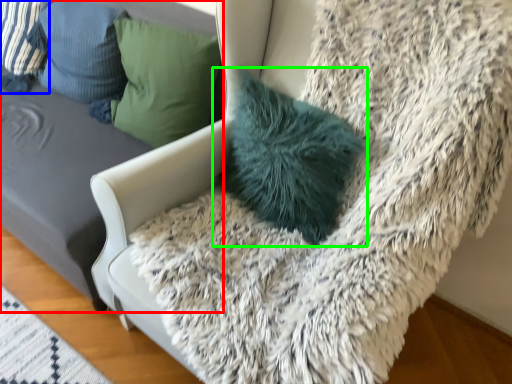
Question: Which is farther away from furniture (highlighted by a red box)? pillow (highlighted by a blue box) or pillow (highlighted by a green box)?

Choices:
 (A) pillow
 (B) pillow

Answer: (B)